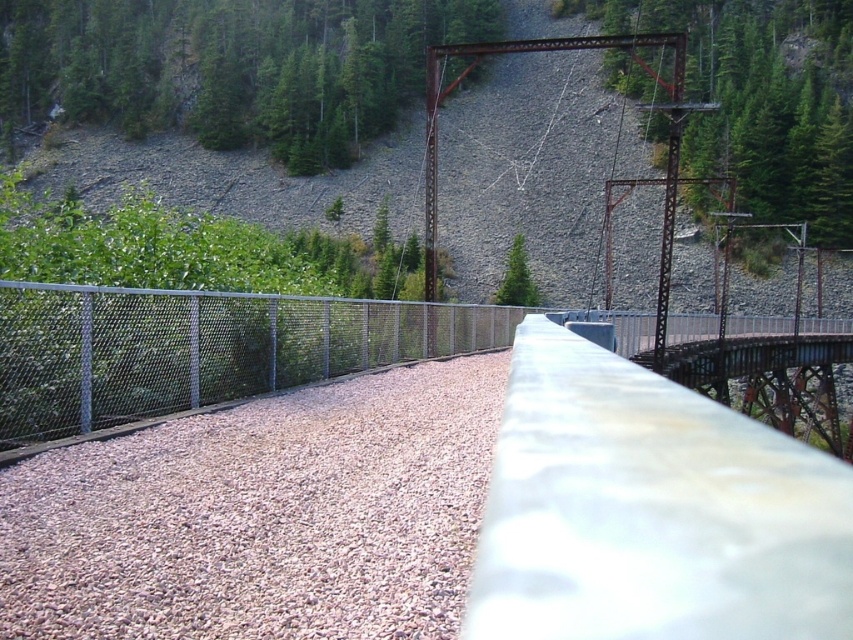
You are standing on the bridge and looking towards the green matte tree at upper center. Which object is directly beneath it, the brown gravel at center or the concrete barrier on the right?

The brown gravel at center is directly beneath the green matte tree at upper center, as it is located below it according to the description.

You are standing on the bridge and notice the brown gravel at center and the green matte tree at center. Which object is positioned to the left when facing the direction of the bridge?

The brown gravel at center is to the left of the green matte tree at center, so when facing the bridge, the brown gravel at center is positioned to the left.

You are standing on the gravelly bridge deck and notice a green matte tree at upper center. Where exactly is this tree positioned relative to your current location?

The green matte tree at upper center is located at point (231, 67), which means it is positioned slightly to the left and above your current position on the bridge.